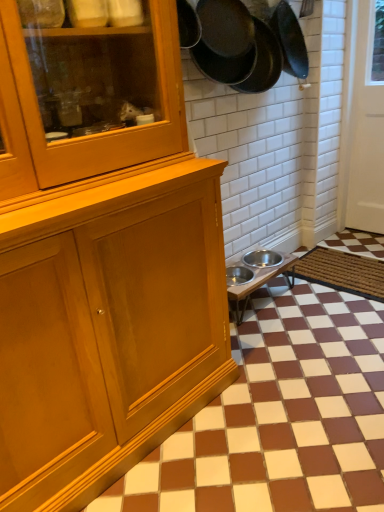
Question: Considering their positions, is black matte frying pan at upper right, placed as the first frying pan when sorted from left to right, located in front of or behind brown matte tile at lower right?

Choices:
 (A) behind
 (B) front

Answer: (A)

Question: In terms of size, does black matte frying pan at upper right, placed as the first frying pan when sorted from left to right, appear bigger or smaller than brown matte tile at lower right?

Choices:
 (A) big
 (B) small

Answer: (B)

Question: Which object is positioned closest to the brown matte tile at lower right?

Choices:
 (A) black matte frying pan at upper right, placed as the first frying pan when sorted from left to right
 (B) metallic stainless steel bowls at lower right
 (C) dark gray matte frying pan at upper right, arranged as the second frying pan when viewed from the left
 (D) white glossy door at right
 (E) brown woven mat at lower right

Answer: (B)

Question: Estimate the real-world distances between objects in this image. Which object is closer to the brown matte tile at lower right?

Choices:
 (A) dark gray matte frying pan at upper right, the first frying pan when ordered from right to left
 (B) white glossy door at right
 (C) black matte frying pan at upper right, placed as the first frying pan when sorted from left to right
 (D) brown woven mat at lower right
 (E) metallic stainless steel bowls at lower right

Answer: (E)